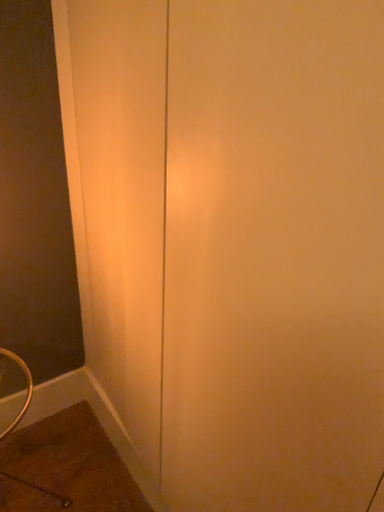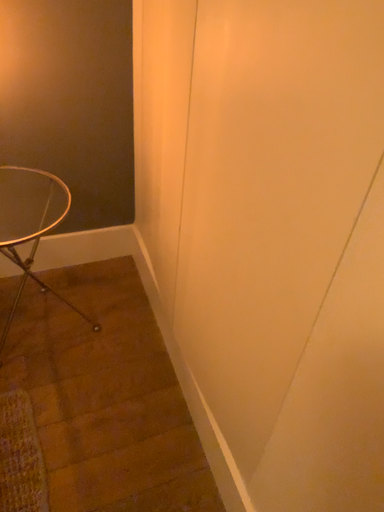
Question: Which way did the camera rotate in the video?

Choices:
 (A) rotated left
 (B) rotated right

Answer: (A)